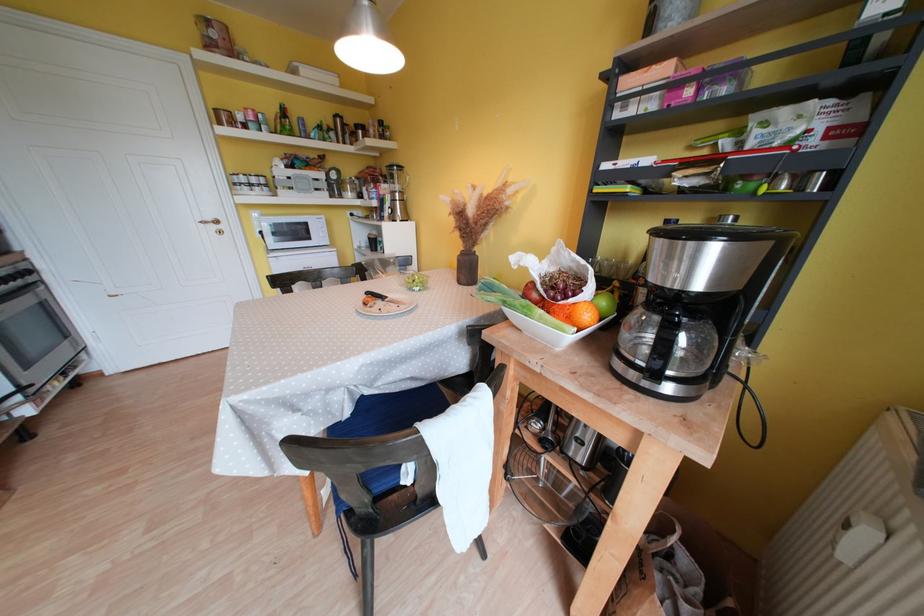
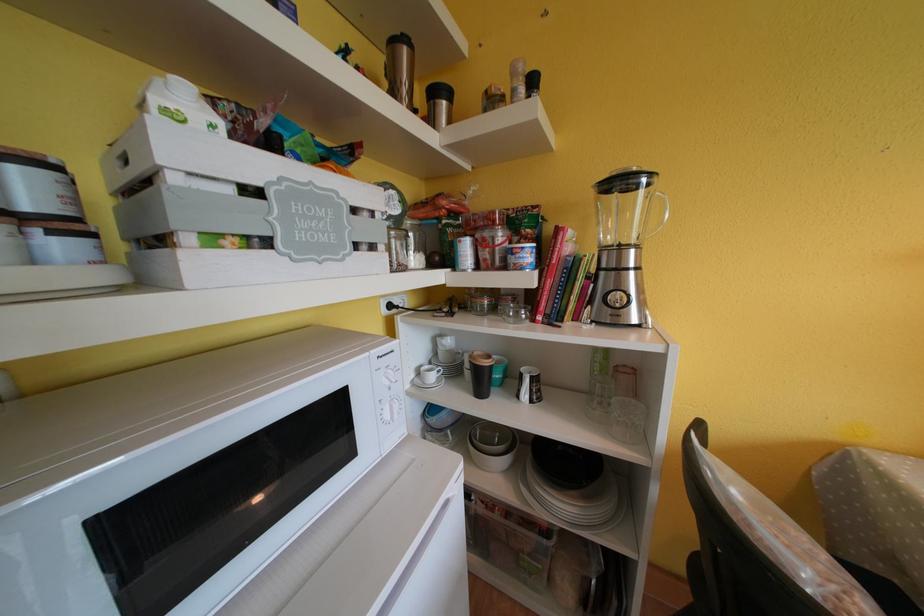
Find the pixel in the second image that matches point (370, 248) in the first image.

(439, 381)